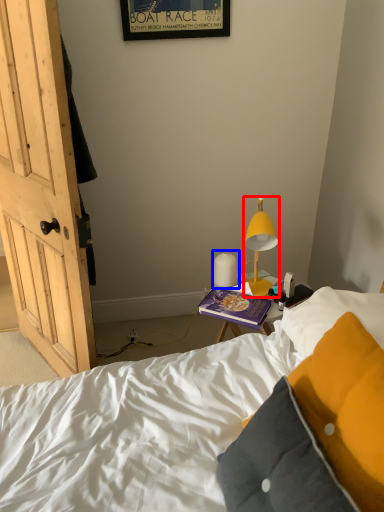
Question: Which object is further to the camera taking this photo, lamp (highlighted by a red box) or lamp (highlighted by a blue box)?

Choices:
 (A) lamp
 (B) lamp

Answer: (B)